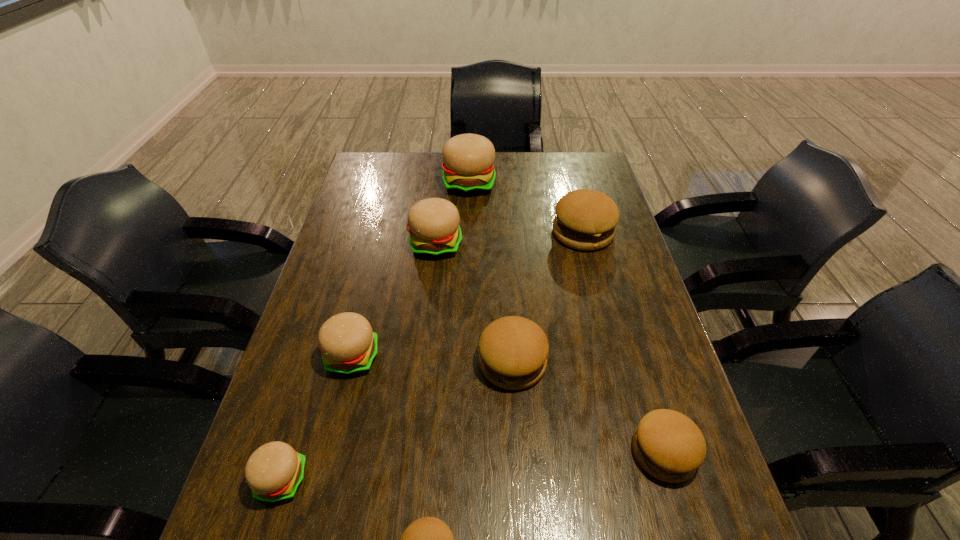
Image resolution: width=960 pixels, height=540 pixels. Find the location of `object that is the closest to the second farthest brown hamburger`. object that is the closest to the second farthest brown hamburger is located at coordinates (668, 445).

The image size is (960, 540). Identify the location of hamburger that is the sixth closest to the third brown hamburger from right to left. (274, 471).

The width and height of the screenshot is (960, 540). I want to click on hamburger that is the fifth closest to the nearest beige hamburger, so click(668, 445).

Identify the location of beige hamburger that is the closest to the leftmost brown hamburger. (274, 471).

What are the coordinates of `beige hamburger that is the fourth closest to the second brown hamburger from left to right` in the screenshot? It's located at (468, 169).

The width and height of the screenshot is (960, 540). Identify the location of brown hamburger identified as the closest to the third biggest brown hamburger. (513, 351).

Find the location of a particular element. Image resolution: width=960 pixels, height=540 pixels. brown hamburger that is the closest one to the biggest brown hamburger is located at coordinates (513, 351).

The height and width of the screenshot is (540, 960). I want to click on blank area in the image that satisfies the following two spatial constraints: 1. on the front side of the third biggest brown hamburger; 2. on the right side of the tallest object, so click(461, 452).

I want to click on vacant region that satisfies the following two spatial constraints: 1. on the back side of the nearest beige hamburger; 2. on the left side of the second biggest beige hamburger, so click(x=353, y=245).